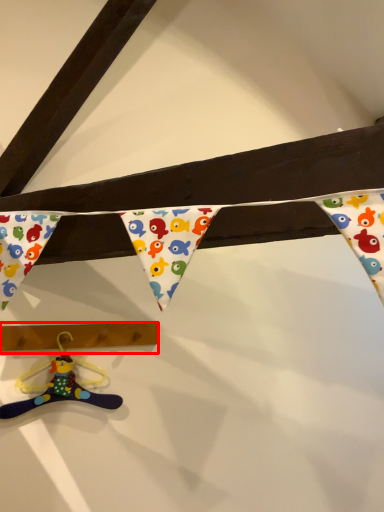
Question: From the image's perspective, what is the correct spatial positioning of plank (annotated by the red box) in reference to toy?

Choices:
 (A) above
 (B) below

Answer: (A)